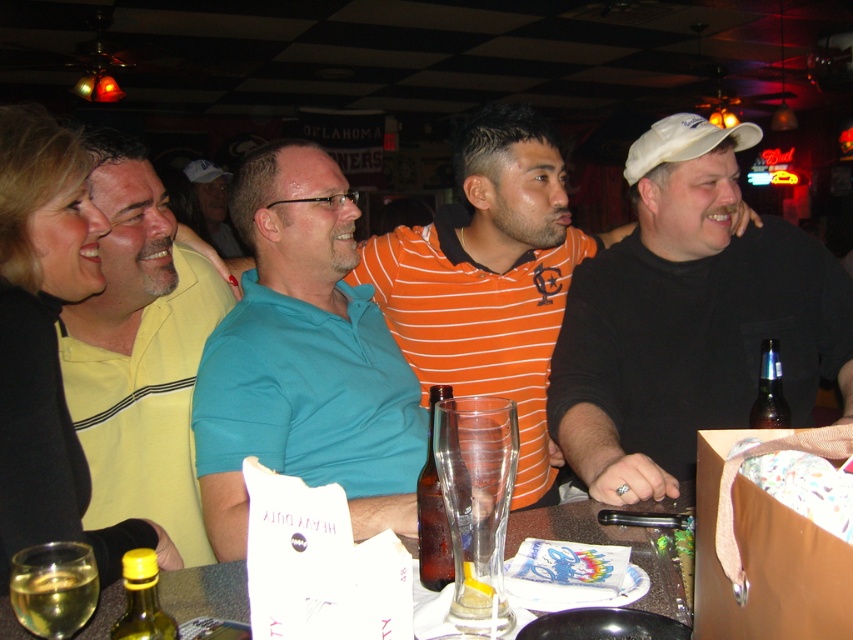
Does black matte shirt at right appear under brown glass bottle at right?

No, black matte shirt at right is not below brown glass bottle at right.

Between point (572, 433) and point (761, 403), which one is positioned in front?

Point (572, 433)

Identify the location of black matte shirt at right. The width and height of the screenshot is (853, 640). (688, 317).

Does yellow striped polo shirt at left have a lesser height compared to brown glass bottle at center?

No, yellow striped polo shirt at left is not shorter than brown glass bottle at center.

Who is taller, yellow striped polo shirt at left or brown glass bottle at center?

yellow striped polo shirt at left

Does point (184, 317) come closer to viewer compared to point (422, 515)?

No, (184, 317) is further to viewer.

The width and height of the screenshot is (853, 640). What are the coordinates of `yellow striped polo shirt at left` in the screenshot? It's located at (138, 352).

What do you see at coordinates (138, 352) in the screenshot? I see `yellow striped polo shirt at left` at bounding box center [138, 352].

Identify the location of yellow striped polo shirt at left. (138, 352).

Image resolution: width=853 pixels, height=640 pixels. In order to click on yellow striped polo shirt at left in this screenshot , I will do `click(138, 352)`.